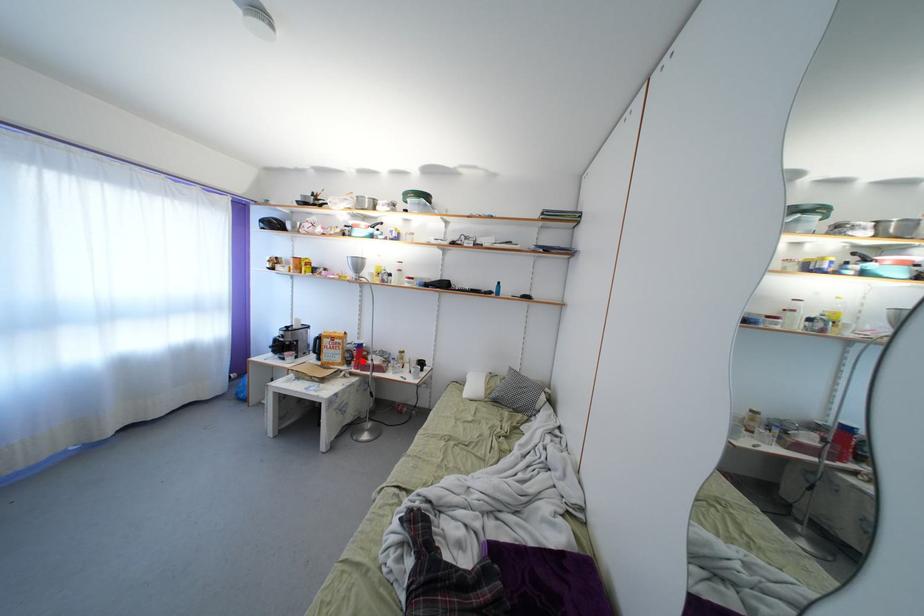
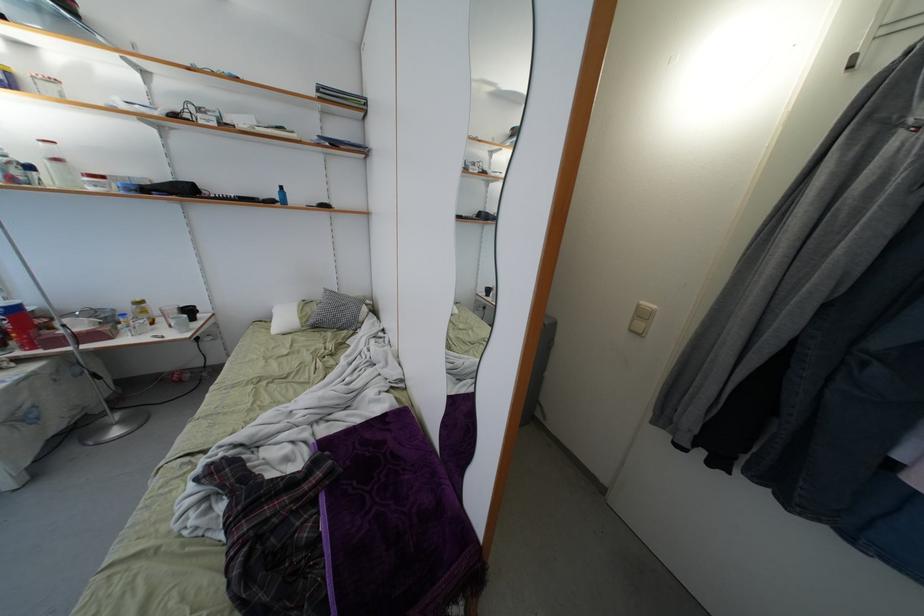
Where in the second image is the point corresponding to the highlighted location from the first image?

(22, 333)